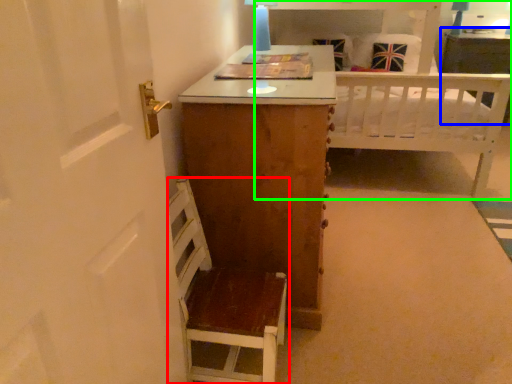
Question: Which object is positioned closest to furniture (highlighted by a red box)? Select from vanity (highlighted by a blue box) and bed (highlighted by a green box).

Choices:
 (A) vanity
 (B) bed

Answer: (B)